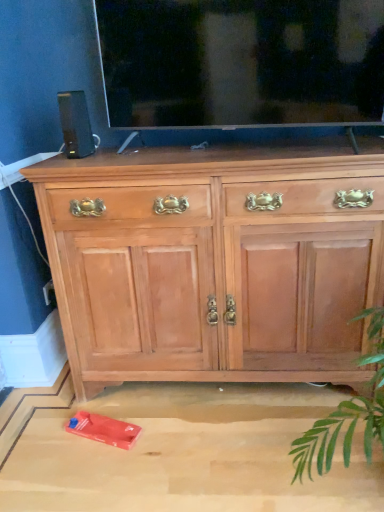
Locate an element on the screen. vacant space to the right of black plastic speaker at upper left is located at coordinates (122, 149).